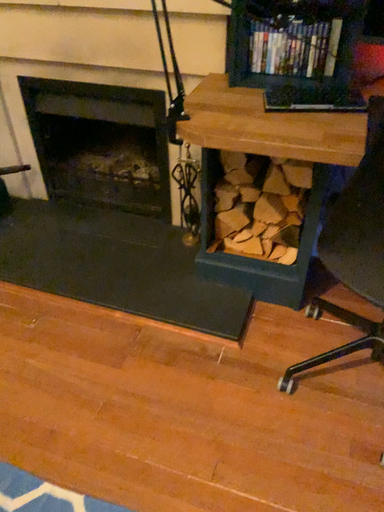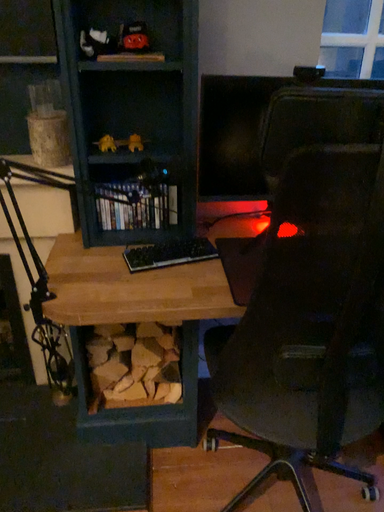
Question: How did the camera likely rotate when shooting the video?

Choices:
 (A) rotated downward
 (B) rotated upward

Answer: (B)